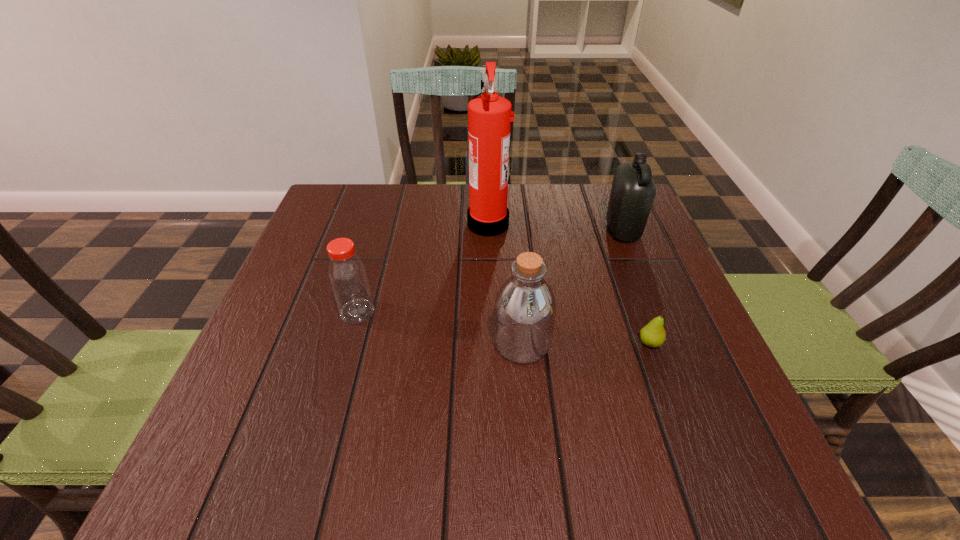
What are the coordinates of `free spot at the near edge of the desktop` in the screenshot? It's located at (301, 478).

Identify the location of blank space at the left edge of the desktop. This screenshot has width=960, height=540. (211, 430).

You are a GUI agent. You are given a task and a screenshot of the screen. Output one action in this format:
    pyautogui.click(x=<x>, y=<y>)
    Task: Click on the free spot at the right edge of the desktop
    This screenshot has width=960, height=540.
    Given the screenshot: What is the action you would take?
    coord(644,237)

You are a GUI agent. You are given a task and a screenshot of the screen. Output one action in this format:
    pyautogui.click(x=<x>, y=<y>)
    Task: Click on the vacant space at the far left corner
    
    Given the screenshot: What is the action you would take?
    pyautogui.click(x=347, y=192)

You are a GUI agent. You are given a task and a screenshot of the screen. Output one action in this format:
    pyautogui.click(x=<x>, y=<y>)
    Task: Click on the vacant area that lies between the pear and the tallest object
    The width and height of the screenshot is (960, 540).
    Given the screenshot: What is the action you would take?
    pyautogui.click(x=569, y=283)

The height and width of the screenshot is (540, 960). In order to click on vacant area that lies between the second bottle from right to left and the fourth tallest object in this screenshot , I will do `click(440, 327)`.

Where is `free area in between the leftmost bottle and the fire extinguisher`? free area in between the leftmost bottle and the fire extinguisher is located at coordinates (422, 267).

Locate an element on the screen. vacant space in between the second bottle from right to left and the second shortest object is located at coordinates (440, 327).

This screenshot has height=540, width=960. I want to click on free space between the second shortest object and the tallest object, so click(422, 267).

This screenshot has height=540, width=960. Find the location of `vacant area that lies between the second bottle from left to right and the shortest object`. vacant area that lies between the second bottle from left to right and the shortest object is located at coordinates (586, 343).